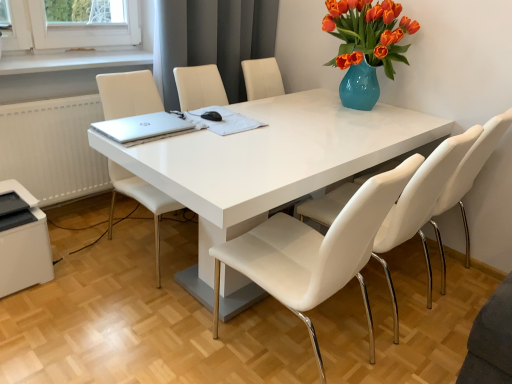
You are a GUI agent. You are given a task and a screenshot of the screen. Output one action in this format:
    pyautogui.click(x=<x>, y=<y>)
    Task: Click on the empty space that is in between white plastic printer at lower left and white leather chair at center, acting as the third chair starting from the right
    This screenshot has height=384, width=512.
    Given the screenshot: What is the action you would take?
    pyautogui.click(x=90, y=267)